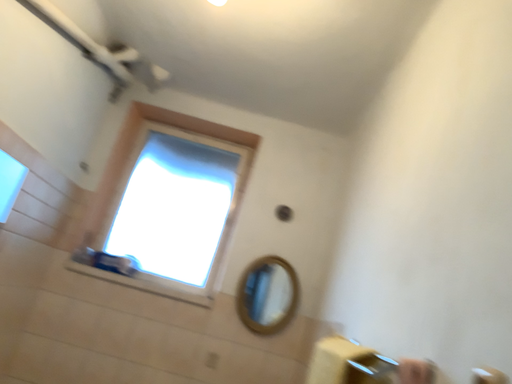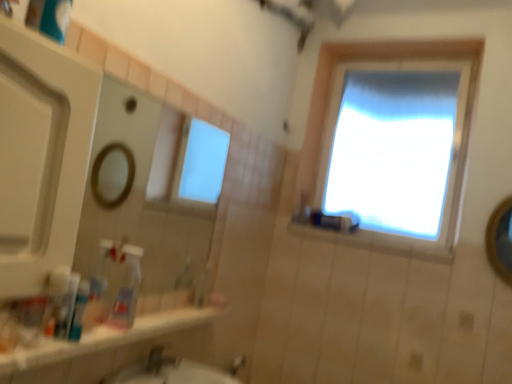
Question: Which way did the camera rotate in the video?

Choices:
 (A) rotated upward
 (B) rotated downward

Answer: (B)